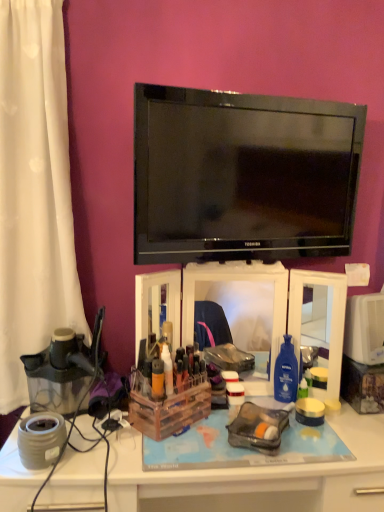
Locate an element on the screen. free spot above transparent plastic makeup organizer at center (from a real-world perspective) is located at coordinates (237, 257).